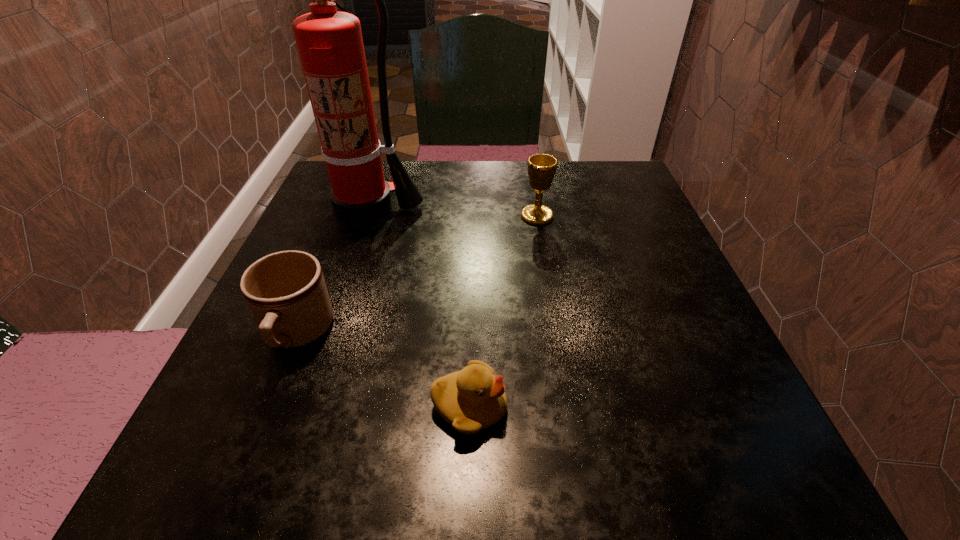
Locate an element on the screen. vacant space at the far left corner of the desktop is located at coordinates (330, 179).

Where is `vacant region at the far right corner`? vacant region at the far right corner is located at coordinates (578, 174).

I want to click on free spot between the mug and the nearest object, so click(x=383, y=370).

Where is `vacant space that's between the second nearest object and the chalice`? The width and height of the screenshot is (960, 540). vacant space that's between the second nearest object and the chalice is located at coordinates (418, 275).

Identify the location of free space between the duckling and the rightmost object. This screenshot has width=960, height=540. (503, 312).

Find the location of a particular element. This screenshot has height=540, width=960. vacant area that lies between the duckling and the rightmost object is located at coordinates pyautogui.click(x=503, y=312).

Find the location of a particular element. This screenshot has height=540, width=960. vacant area that lies between the nearest object and the tallest object is located at coordinates (419, 307).

The image size is (960, 540). I want to click on vacant area that lies between the fire extinguisher and the mug, so click(x=332, y=271).

The image size is (960, 540). I want to click on blank region between the fire extinguisher and the nearest object, so click(x=419, y=307).

I want to click on free space between the rightmost object and the fire extinguisher, so click(x=452, y=212).